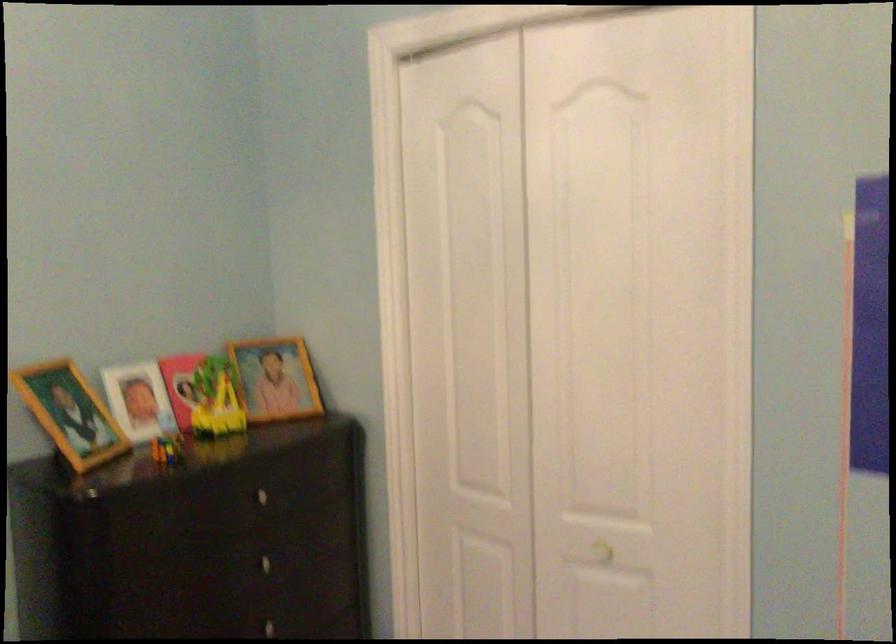
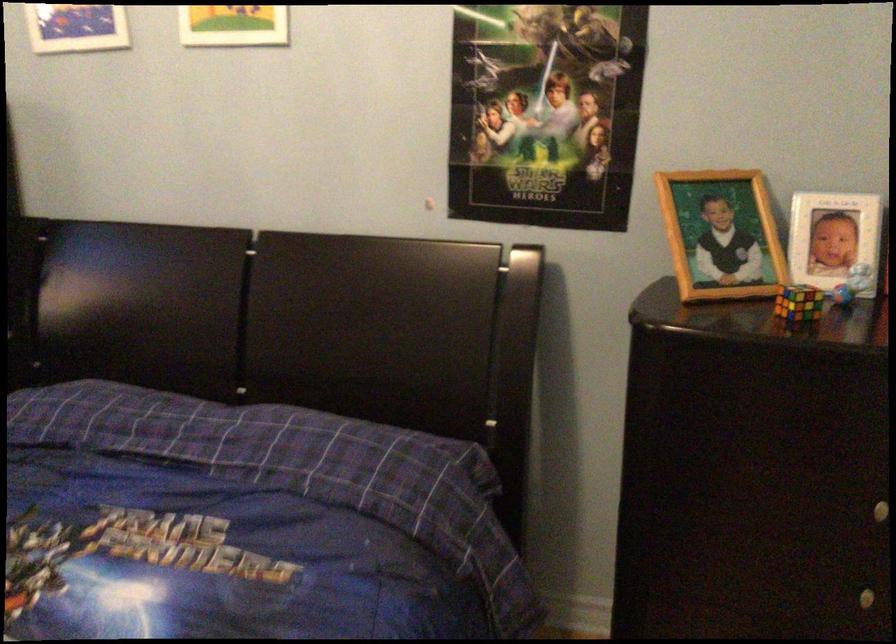
Locate, in the second image, the point that corresponds to (167,444) in the first image.

(798, 303)